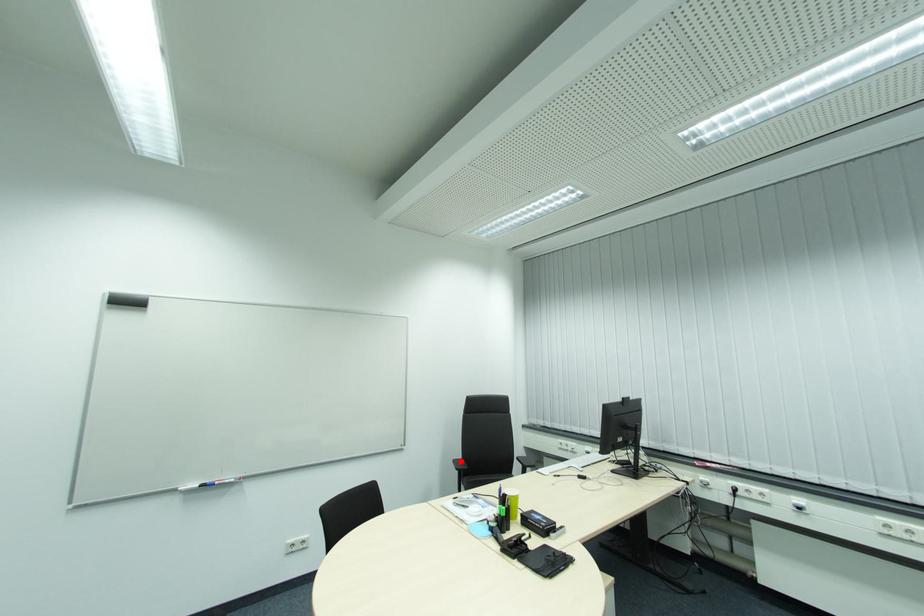
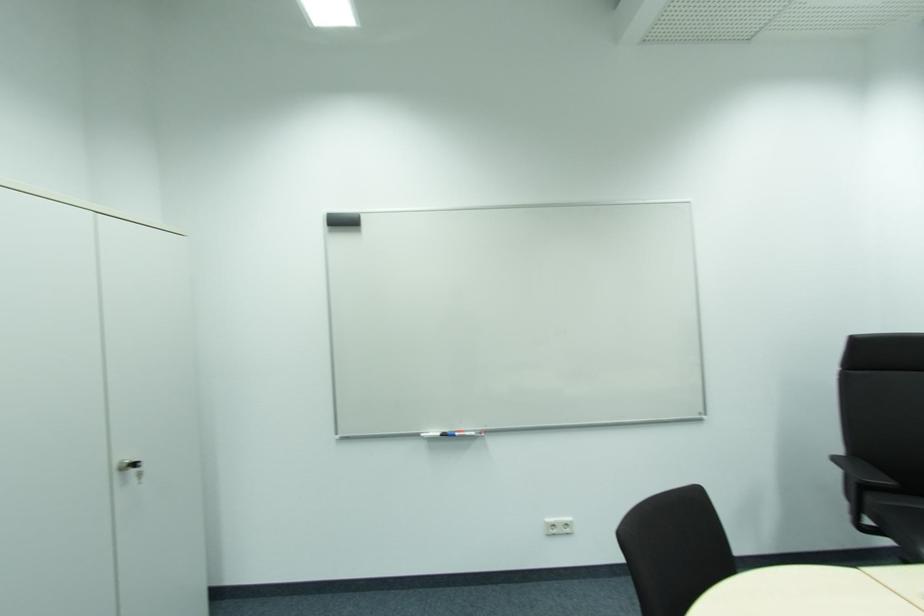
Question: A red point is marked in image1. In image2, is the corresponding 3D point closer to the camera or farther? Reply with the corresponding letter.

Choices:
 (A) The corresponding 3D point is closer.
 (B) The corresponding 3D point is farther.

Answer: (A)